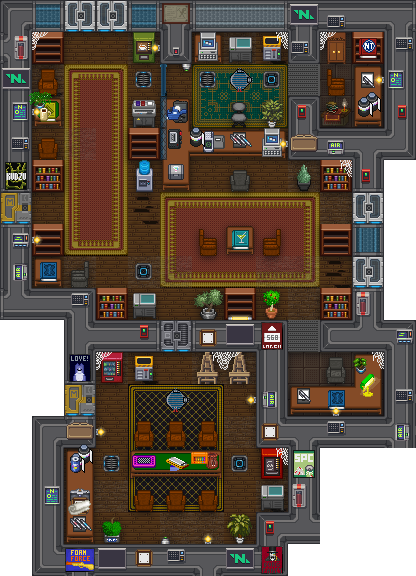
This screenshot has width=416, height=576. I want to click on potted plants, so click(40, 98), click(271, 112), click(306, 175), click(205, 309), click(276, 308), click(360, 365), click(110, 537), click(242, 532).